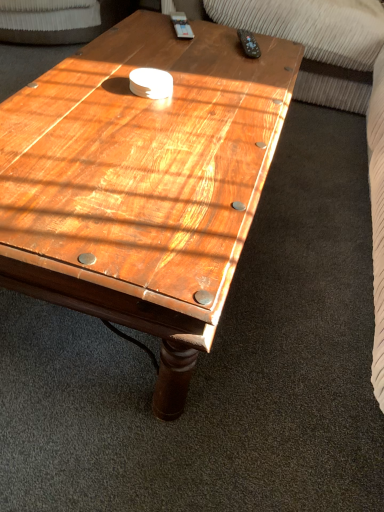
Locate an element on the screen. The height and width of the screenshot is (512, 384). free space in front of black plastic remote at upper right is located at coordinates (241, 70).